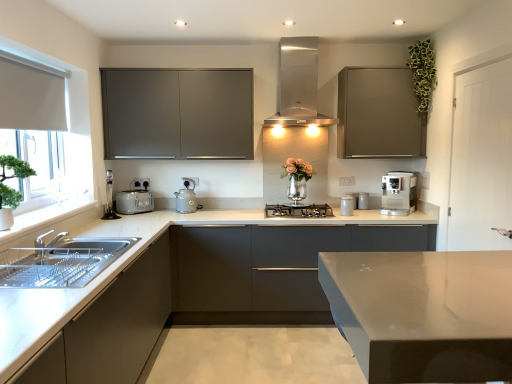
Describe the element at coordinates (177, 113) in the screenshot. I see `matte gray cabinet at upper center, arranged as the second cabinetry when viewed from the top` at that location.

In order to face matte gray cabinet at upper center, placed as the fifth cabinetry when sorted from bottom to top, should I rotate leftwards or rightwards?

To face it directly, rotate left by 9.936 degrees.

In order to face white marble countertop at lower left, positioned as the first cabinetry in bottom-to-top order, should I rotate leftwards or rightwards?

Turn left approximately 22.971 degrees to face it.

What is the approximate height of green leafy plant at upper right?

24.24 inches.

Locate an element on the screen. The height and width of the screenshot is (384, 512). matte gray cabinet at upper right, which is the first cabinetry from top to bottom is located at coordinates (379, 114).

This screenshot has width=512, height=384. I want to click on matte gray cabinet at upper center, placed as the fifth cabinetry when sorted from bottom to top, so (x=177, y=113).

Which of these two, matte gray cabinet at upper center, arranged as the second cabinetry when viewed from the top, or matte gray canister at center, placed as the first appliance when sorted from front to back, stands taller?

Standing taller between the two is matte gray cabinet at upper center, arranged as the second cabinetry when viewed from the top.

Can you confirm if matte gray cabinet at upper center, arranged as the second cabinetry when viewed from the top, is bigger than matte gray canister at center, the third appliance viewed from the back?

Indeed, matte gray cabinet at upper center, arranged as the second cabinetry when viewed from the top, has a larger size compared to matte gray canister at center, the third appliance viewed from the back.

From a real-world perspective, is matte gray cabinet at upper center, arranged as the second cabinetry when viewed from the top, over matte gray canister at center, which is counted as the second appliance, starting from the right?

Yes, from a real-world perspective, matte gray cabinet at upper center, arranged as the second cabinetry when viewed from the top, is over matte gray canister at center, which is counted as the second appliance, starting from the right

Is the depth of matte gray cabinet at upper center, placed as the fifth cabinetry when sorted from bottom to top, less than that of matte gray canister at center, placed as the first appliance when sorted from front to back?

Yes, matte gray cabinet at upper center, placed as the fifth cabinetry when sorted from bottom to top, is closer to the viewer.

Are satin silver coffee machine at right, positioned as the 1th home appliance in right-to-left order, and metallic gray canister at center-right, which appears as the 1th appliance when viewed from the right, located far from each other?

satin silver coffee machine at right, positioned as the 1th home appliance in right-to-left order, is near metallic gray canister at center-right, which appears as the 1th appliance when viewed from the right, not far away.

Is satin silver coffee machine at right, which appears as the second home appliance when ordered from the bottom, taller than metallic gray canister at center-right, which appears as the 1th appliance when viewed from the right?

Yes.

Measure the distance from satin silver coffee machine at right, positioned as the 3th home appliance in left-to-right order, to metallic gray canister at center-right, which appears as the 1th appliance when viewed from the right.

satin silver coffee machine at right, positioned as the 3th home appliance in left-to-right order, and metallic gray canister at center-right, which appears as the 1th appliance when viewed from the right, are 10.90 inches apart.

Is satin silver coffee machine at right, positioned as the 1th home appliance in right-to-left order, further to the viewer compared to metallic gray canister at center-right, which ranks as the third appliance in left-to-right order?

No, satin silver coffee machine at right, positioned as the 1th home appliance in right-to-left order, is closer to the camera.

Is matte gray cabinet at upper right, which is the first cabinetry from top to bottom, oriented away from matte gray cabinet at center, marked as the second cabinetry in a bottom-to-top arrangement?

No, matte gray cabinet at upper right, which is the first cabinetry from top to bottom,'s orientation is not away from matte gray cabinet at center, marked as the second cabinetry in a bottom-to-top arrangement.

Looking at this image, from the image's perspective, who appears lower, matte gray cabinet at upper right, which is the first cabinetry from top to bottom, or matte gray cabinet at center, acting as the 5th cabinetry starting from the top?

From the image's view, matte gray cabinet at center, acting as the 5th cabinetry starting from the top, is below.

Is matte gray cabinet at upper right, which is the first cabinetry from top to bottom, taller or shorter than matte gray cabinet at center, acting as the 5th cabinetry starting from the top?

matte gray cabinet at upper right, which is the first cabinetry from top to bottom, is shorter than matte gray cabinet at center, acting as the 5th cabinetry starting from the top.

Is matte gray cabinet at upper right, which is the 6th cabinetry in bottom-to-top order, spatially inside matte gray cabinet at center, acting as the 5th cabinetry starting from the top, or outside of it?

matte gray cabinet at upper right, which is the 6th cabinetry in bottom-to-top order, is outside matte gray cabinet at center, acting as the 5th cabinetry starting from the top.

Is matte gray cabinets at center, which appears as the fourth cabinetry when viewed from the top, not within metallic gray canister at center-right, which appears as the 1th appliance when viewed from the right?

Yes, matte gray cabinets at center, which appears as the fourth cabinetry when viewed from the top, is outside of metallic gray canister at center-right, which appears as the 1th appliance when viewed from the right.

Is matte gray cabinets at center, the 3th cabinetry from the bottom, shorter than metallic gray canister at center-right, which ranks as the third appliance in left-to-right order?

Incorrect, the height of matte gray cabinets at center, the 3th cabinetry from the bottom, does not fall short of that of metallic gray canister at center-right, which ranks as the third appliance in left-to-right order.

From a real-world perspective, is matte gray cabinets at center, which appears as the fourth cabinetry when viewed from the top, physically above metallic gray canister at center-right, which ranks as the third appliance in left-to-right order?

No.

From the image's perspective, is matte gray cabinets at center, the 3th cabinetry from the bottom, under metallic gray canister at center-right, which appears as the 1th appliance when viewed from the right?

Yes.

How different are the orientations of green leafy plant at upper right and matte gray cabinet at upper center, placed as the fifth cabinetry when sorted from bottom to top, in degrees?

There is a 0.647-degree angle between the facing directions of green leafy plant at upper right and matte gray cabinet at upper center, placed as the fifth cabinetry when sorted from bottom to top.

Is green leafy plant at upper right taller than matte gray cabinet at upper center, placed as the fifth cabinetry when sorted from bottom to top?

Incorrect, the height of green leafy plant at upper right is not larger of that of matte gray cabinet at upper center, placed as the fifth cabinetry when sorted from bottom to top.

Does point (429, 98) appear closer or farther from the camera than point (172, 107)?

Point (429, 98) is positioned closer to the camera compared to point (172, 107).

Does point (368, 207) come behind point (176, 209)?

Yes, point (368, 207) is behind point (176, 209).

How much distance is there between metallic gray canister at center-right, which ranks as the third appliance in left-to-right order, and matte gray kettle at center, the third appliance in the right-to-left sequence?

metallic gray canister at center-right, which ranks as the third appliance in left-to-right order, and matte gray kettle at center, the third appliance in the right-to-left sequence, are 5.01 feet apart.

From the image's perspective, is metallic gray canister at center-right, marked as the third appliance in a front-to-back arrangement, located beneath matte gray kettle at center, which ranks as the second appliance in back-to-front order?

No.

Would you say metallic gray canister at center-right, which appears as the 1th appliance when viewed from the right, contains matte gray kettle at center, which ranks as the second appliance in back-to-front order?

No, matte gray kettle at center, which ranks as the second appliance in back-to-front order, is located outside of metallic gray canister at center-right, which appears as the 1th appliance when viewed from the right.

There is a white wood door at right. Where is `the 2nd cabinetry above it (from a real-world perspective)`? The height and width of the screenshot is (384, 512). the 2nd cabinetry above it (from a real-world perspective) is located at coordinates (177, 113).

Between matte gray cabinet at upper center, arranged as the second cabinetry when viewed from the top, and white wood door at right, which one has more height?

With more height is white wood door at right.

How different are the orientations of matte gray cabinet at upper center, arranged as the second cabinetry when viewed from the top, and white wood door at right in degrees?

The angle between the facing direction of matte gray cabinet at upper center, arranged as the second cabinetry when viewed from the top, and the facing direction of white wood door at right is 90.1 degrees.

Is matte gray cabinet at upper center, placed as the fifth cabinetry when sorted from bottom to top, spatially inside white wood door at right, or outside of it?

matte gray cabinet at upper center, placed as the fifth cabinetry when sorted from bottom to top, is spatially situated outside white wood door at right.

Identify the location of the 2nd appliance to the right of the matte gray cabinet at upper center, placed as the fifth cabinetry when sorted from bottom to top, counting from the anchor's position. (347, 206).

From the image's perspective, count 1st home appliances upward from the metallic gray canister at center-right, which appears as the 1th appliance when viewed from the right, and point to it. Please provide its 2D coordinates.

[(398, 193)]

Which object lies further to the anchor point matte gray cabinets at center, which appears as the fourth cabinetry when viewed from the top, matte gray cabinet at center, acting as the 5th cabinetry starting from the top, or satin silver toaster at lower left?

The object further to matte gray cabinets at center, which appears as the fourth cabinetry when viewed from the top, is satin silver toaster at lower left.

Looking at the image, which one is located closer to matte gray cabinet at upper center, arranged as the second cabinetry when viewed from the top, matte gray canister at center, placed as the first appliance when sorted from front to back, or stainless steel range hood at center, the 1th home appliance from the top?

stainless steel range hood at center, the 1th home appliance from the top, is closer to matte gray cabinet at upper center, arranged as the second cabinetry when viewed from the top.

In the scene shown: Considering their positions, is white fabric at left positioned further to satin silver toaster at lower left than matte gray cabinet at upper right, which is the 6th cabinetry in bottom-to-top order?

matte gray cabinet at upper right, which is the 6th cabinetry in bottom-to-top order, is positioned further to the anchor satin silver toaster at lower left.

Looking at the image, which one is located further to matte gray cabinet at upper center, placed as the fifth cabinetry when sorted from bottom to top, green leafy plant at upper right or white wood door at right?

Among the two, white wood door at right is located further to matte gray cabinet at upper center, placed as the fifth cabinetry when sorted from bottom to top.

When comparing their distances from matte gray canister at center, placed as the first appliance when sorted from front to back, does matte gray cabinets at center, which appears as the fourth cabinetry when viewed from the top, or satin silver toaster at lower left seem further?

satin silver toaster at lower left is further to matte gray canister at center, placed as the first appliance when sorted from front to back.

Estimate the real-world distances between objects in this image. Which object is closer to white marble sink at left, satin silver toaster at lower left or metallic gray canister at center-right, which ranks as the third appliance in left-to-right order?

satin silver toaster at lower left is closer to white marble sink at left.

Estimate the real-world distances between objects in this image. Which object is further from matte gray cabinets at center, which appears as the fourth cabinetry when viewed from the top, matte gray cabinet at center, acting as the 5th cabinetry starting from the top, or matte gray kettle at center, the 2th appliance viewed from the front?

Based on the image, matte gray kettle at center, the 2th appliance viewed from the front, appears to be further to matte gray cabinets at center, which appears as the fourth cabinetry when viewed from the top.

Estimate the real-world distances between objects in this image. Which object is further from matte gray cabinets at center, which appears as the fourth cabinetry when viewed from the top, white fabric at left or white wood door at right?

white fabric at left lies further to matte gray cabinets at center, which appears as the fourth cabinetry when viewed from the top, than the other object.

Identify the location of window sill located between white marble countertop at lower left, positioned as the first cabinetry in bottom-to-top order, and matte gray kettle at center, which is the first appliance from left to right, in the depth direction. pyautogui.click(x=45, y=218).

Where is `kitchen appliance between white marble sink at left and green leafy plant at upper right in the horizontal direction`? This screenshot has height=384, width=512. kitchen appliance between white marble sink at left and green leafy plant at upper right in the horizontal direction is located at coordinates (134, 202).

Find the location of a particular element. window sill positioned between white marble countertop at lower left, the sixth cabinetry positioned from the top, and matte gray canister at center, which is counted as the second appliance, starting from the right, from near to far is located at coordinates (45, 218).

Identify the location of home appliance that lies between stainless steel range hood at center, arranged as the 3th home appliance when ordered from the bottom, and black glass cooktop at center, which appears as the second home appliance when viewed from the left, from top to bottom. (398, 193).